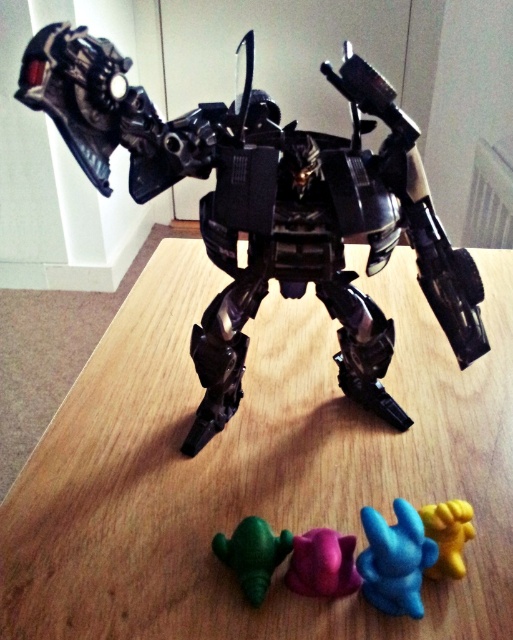
Question: Does blue rubber toy at lower center appear over yellow rubber toy at lower right?

Choices:
 (A) no
 (B) yes

Answer: (A)

Question: Is wooden table at center to the right of black plastic gun at center from the viewer's perspective?

Choices:
 (A) no
 (B) yes

Answer: (A)

Question: Which point is farther to the camera?

Choices:
 (A) wooden table at center
 (B) metallic black robot at center
 (C) blue rubber toy at lower center

Answer: (A)

Question: Which point is closer to the camera?

Choices:
 (A) (407, 605)
 (B) (147, 573)
 (C) (334, 538)

Answer: (A)

Question: Is black plastic gun at center to the right of yellow rubber toy at lower right from the viewer's perspective?

Choices:
 (A) no
 (B) yes

Answer: (A)

Question: Which point is farther to the camera?

Choices:
 (A) black plastic gun at center
 (B) wooden table at center

Answer: (A)